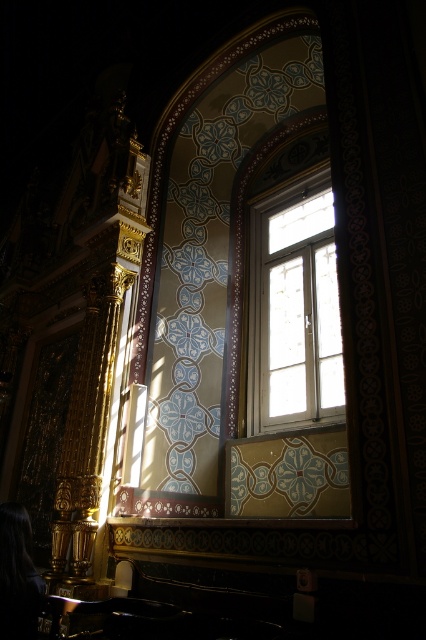
The image size is (426, 640). What do you see at coordinates (293, 308) in the screenshot? I see `clear glass window at center` at bounding box center [293, 308].

Is point (253, 428) positioned before point (3, 598)?

No.

Image resolution: width=426 pixels, height=640 pixels. Identify the location of clear glass window at center. (293, 308).